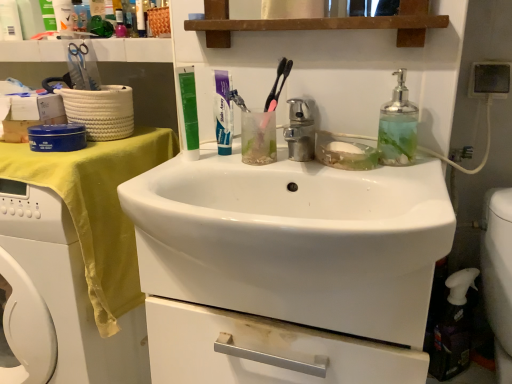
Find the location of a particular element. vacant space in front of green matte toothpaste tube at upper center is located at coordinates (168, 177).